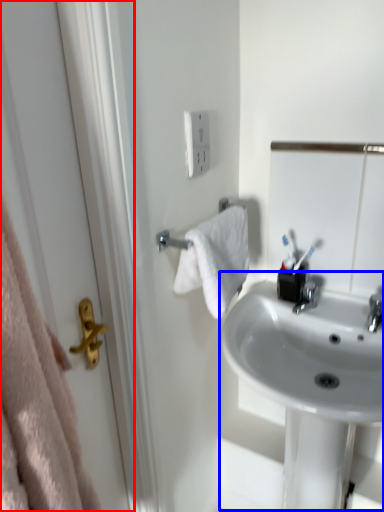
Question: Which point is closer to the camera, screen door (highlighted by a red box) or sink (highlighted by a blue box)?

Choices:
 (A) screen door
 (B) sink

Answer: (A)